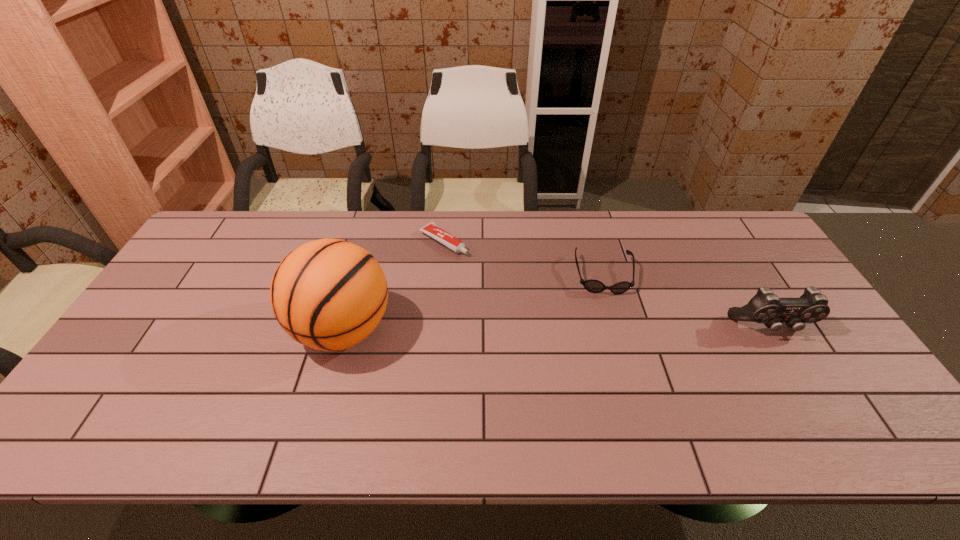
Find the location of a particular element. free spot between the tallest object and the third tallest object is located at coordinates (473, 302).

This screenshot has width=960, height=540. What are the coordinates of `vacant region between the toothpaste and the rightmost object` in the screenshot? It's located at point(608,285).

Where is `blank region between the control and the leftmost object`? blank region between the control and the leftmost object is located at coordinates (557, 329).

At what (x,y) coordinates should I click in order to perform the action: click on the second closest object to the third object from right to left. Please return your answer as a coordinate pair (x, y). Looking at the image, I should click on (594, 286).

Locate an element on the screen. Image resolution: width=960 pixels, height=540 pixels. object that can be found as the closest to the tallest object is located at coordinates (431, 229).